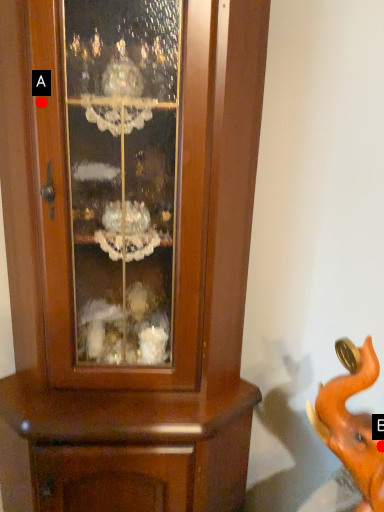
Question: Two points are circled on the image, labeled by A and B beside each circle. Which point is closer to the camera?

Choices:
 (A) A is closer
 (B) B is closer

Answer: (B)